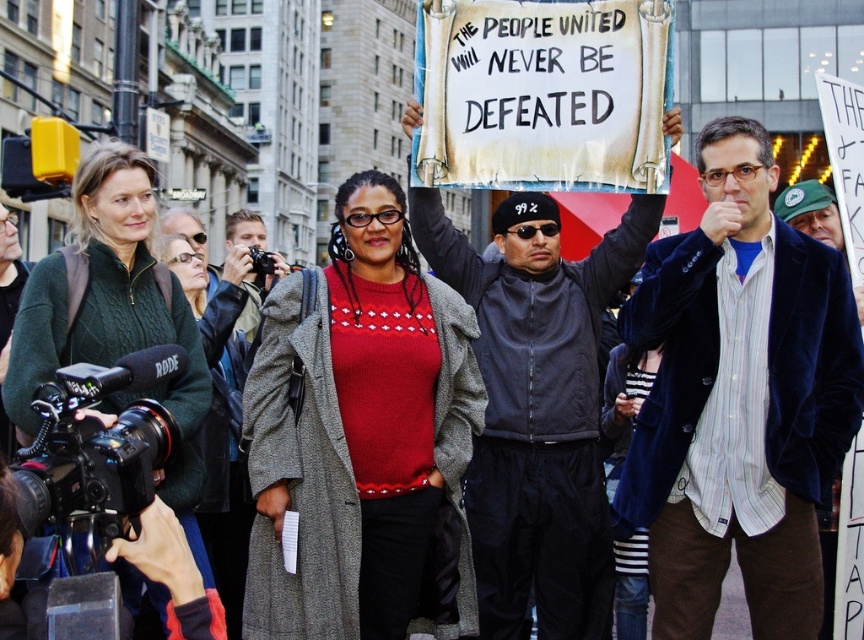
Question: Does velvet blue blazer at center lie behind green knitted sweater at left?

Choices:
 (A) yes
 (B) no

Answer: (A)

Question: Which is farther from the dark gray leather jacket at center?

Choices:
 (A) green knitted sweater at left
 (B) velvet blue blazer at upper right
 (C) velvet blue blazer at center

Answer: (A)

Question: Does knitted red sweater at center have a lesser width compared to green wool coat at left?

Choices:
 (A) no
 (B) yes

Answer: (A)

Question: Which is farther from the dark gray leather jacket at center?

Choices:
 (A) knitted red sweater at center
 (B) green knitted sweater at left
 (C) velvet blue blazer at center

Answer: (B)

Question: Which point is closer to the camera taking this photo?

Choices:
 (A) (337, 278)
 (B) (99, 163)
 (C) (706, 291)
 (D) (582, 300)

Answer: (C)

Question: Considering the relative positions of knitted red sweater at center and dark gray leather jacket at center in the image provided, where is knitted red sweater at center located with respect to dark gray leather jacket at center?

Choices:
 (A) above
 (B) below

Answer: (B)